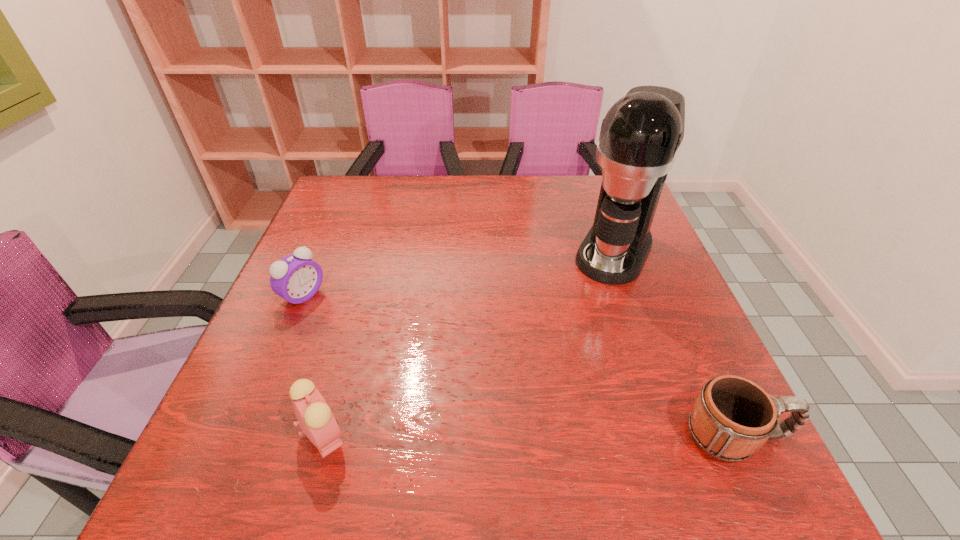
Locate an element on the screen. The width and height of the screenshot is (960, 540). vacant space that is in between the mug and the farther alarm clock is located at coordinates (520, 366).

I want to click on free area in between the third object from right to left and the mug, so click(531, 435).

This screenshot has width=960, height=540. I want to click on free spot between the mug and the leftmost object, so click(520, 366).

Find the location of `free space between the nearer alarm clock and the tallest object`. free space between the nearer alarm clock and the tallest object is located at coordinates (469, 343).

You are a GUI agent. You are given a task and a screenshot of the screen. Output one action in this format:
    pyautogui.click(x=<x>, y=<y>)
    Task: Click on the free space that is in between the coffee maker and the farther alarm clock
    This screenshot has height=540, width=960.
    Given the screenshot: What is the action you would take?
    [459, 273]

I want to click on unoccupied position between the farther alarm clock and the mug, so click(x=520, y=366).

Image resolution: width=960 pixels, height=540 pixels. In order to click on object that is the third closest to the second object from left to right in this screenshot , I will do `click(732, 417)`.

Select which object is the closest to the second object from left to right. Please provide its 2D coordinates. Your answer should be formatted as a tuple, i.e. [(x, y)], where the tuple contains the x and y coordinates of a point satisfying the conditions above.

[(296, 278)]

This screenshot has height=540, width=960. Identify the location of vacant space that satisfies the following two spatial constraints: 1. on the back side of the left alarm clock; 2. on the right side of the tallest object. (322, 252).

At what (x,y) coordinates should I click in order to perform the action: click on free spot that satisfies the following two spatial constraints: 1. on the front side of the leftmost object; 2. on the face of the second object from left to right. Please return your answer as a coordinate pair (x, y). The image size is (960, 540). Looking at the image, I should click on (244, 435).